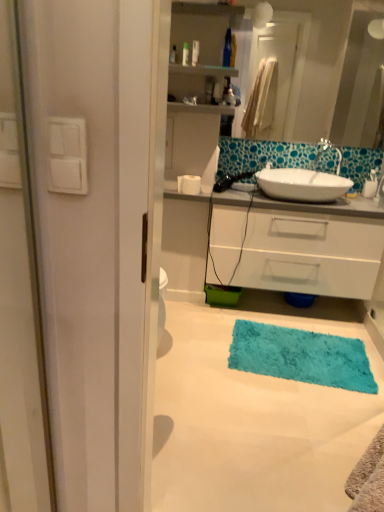
Identify the location of free space to the left of translucent plastic bottle at upper center. The width and height of the screenshot is (384, 512). [x=201, y=67].